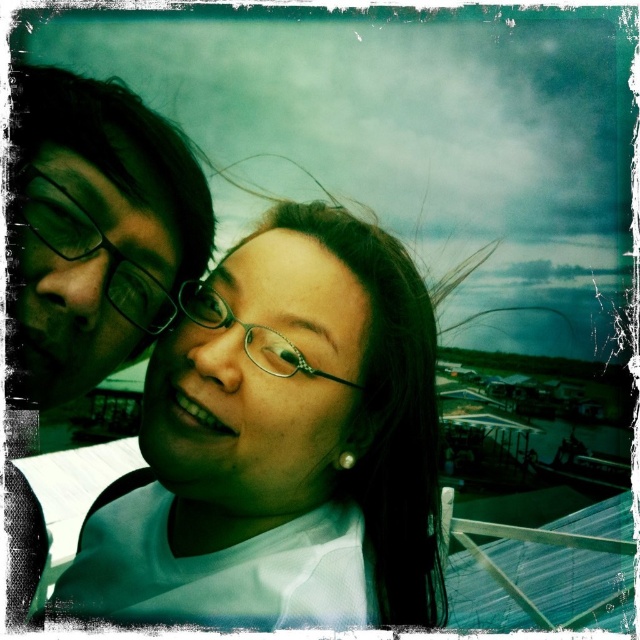
You are a photographer trying to capture a clear photo of both the pearl earrings at center and the matte black glasses at upper left. Given that your camera has a depth of field that can focus on objects within a 10 inch range, will both items be in focus?

The distance between the pearl earrings at center and the matte black glasses at upper left is 12.88 inches, which exceeds the camera focus range of 10 inches. Therefore, both items cannot be in focus simultaneously.